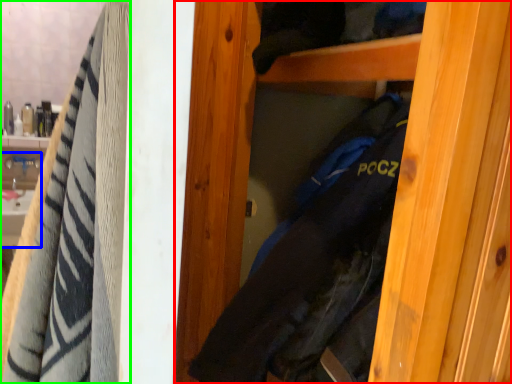
Question: Considering the real-world distances, which object is closest to door (highlighted by a red box)? sink (highlighted by a blue box) or towel (highlighted by a green box).

Choices:
 (A) sink
 (B) towel

Answer: (B)